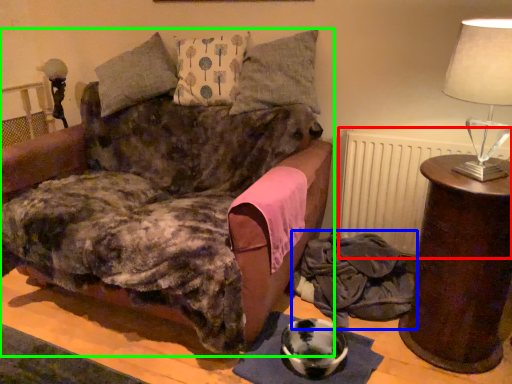
Question: Estimate the real-world distances between objects in this image. Which object is closer to radiator (highlighted by a red box), material (highlighted by a blue box) or furniture (highlighted by a green box)?

Choices:
 (A) material
 (B) furniture

Answer: (A)